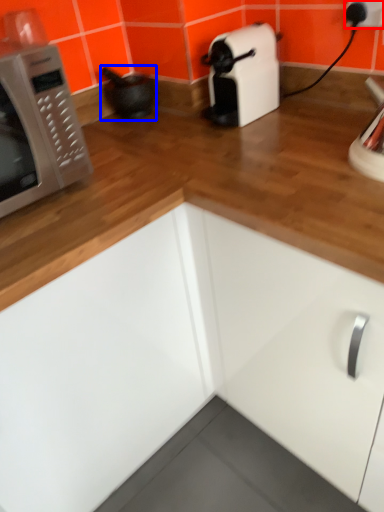
Question: Among these objects, which one is nearest to the camera, electric outlet (highlighted by a red box) or appliance (highlighted by a blue box)?

Choices:
 (A) electric outlet
 (B) appliance

Answer: (A)